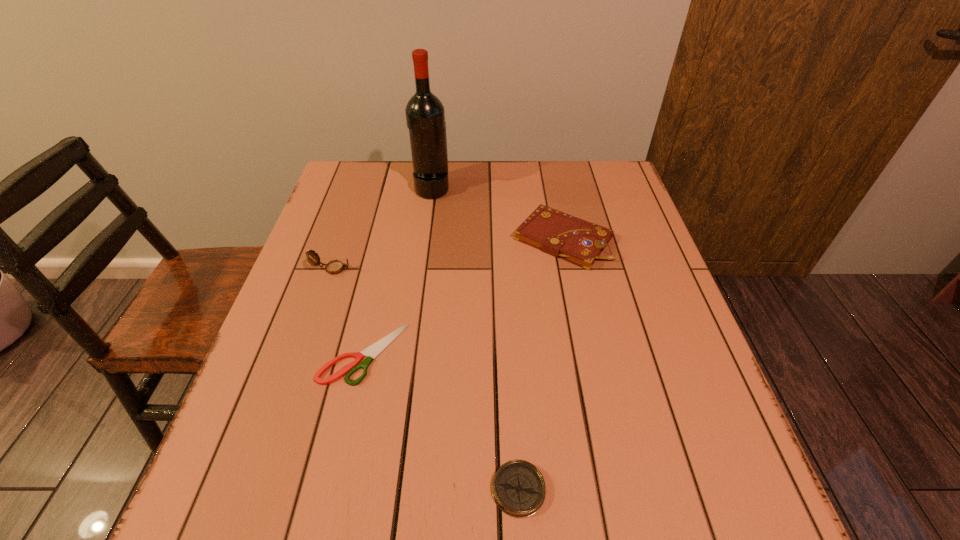
This screenshot has width=960, height=540. Identify the location of wine bottle. (425, 116).

In order to click on the tallest object in this screenshot , I will do `click(425, 116)`.

Identify the location of the second tallest object. (334, 267).

This screenshot has width=960, height=540. I want to click on the taller compass, so click(334, 267).

At what (x,y) coordinates should I click in order to perform the action: click on the third shortest object. Please return your answer as a coordinate pair (x, y). The image size is (960, 540). Looking at the image, I should click on (580, 242).

At what (x,y) coordinates should I click in order to perform the action: click on the second shortest object. Please return your answer as a coordinate pair (x, y). Image resolution: width=960 pixels, height=540 pixels. Looking at the image, I should click on (518, 488).

Find the location of a particular element. the nearer compass is located at coordinates (518, 488).

The image size is (960, 540). In order to click on the shortest object in this screenshot , I will do `click(371, 352)`.

The height and width of the screenshot is (540, 960). Find the location of `the second nearest object`. the second nearest object is located at coordinates (371, 352).

What are the coordinates of `vacant space located 0.110m on the left of the wine bottle` in the screenshot? It's located at (379, 188).